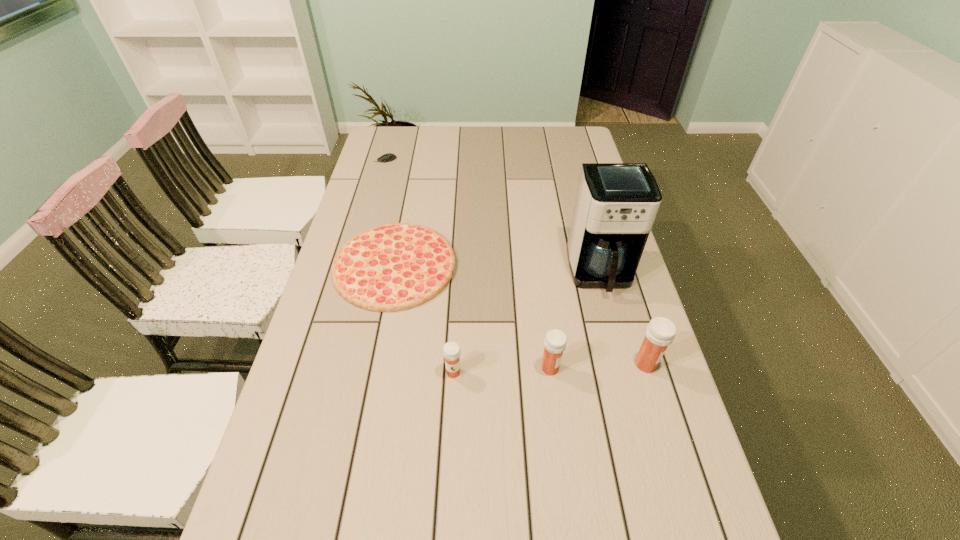
The width and height of the screenshot is (960, 540). In order to click on the shortest medicine in this screenshot , I will do `click(451, 350)`.

Find the location of a particular element. The height and width of the screenshot is (540, 960). the third shortest object is located at coordinates (451, 350).

Image resolution: width=960 pixels, height=540 pixels. Identify the location of the second tallest medicine. [x=555, y=341].

In order to click on the second medicine from left to right in this screenshot , I will do `click(555, 341)`.

Image resolution: width=960 pixels, height=540 pixels. In order to click on the second tallest object in this screenshot , I will do `click(660, 332)`.

Locate an element on the screen. the rightmost medicine is located at coordinates (660, 332).

This screenshot has width=960, height=540. I want to click on computer mouse, so click(388, 157).

Where is `coffee maker`? coffee maker is located at coordinates (616, 204).

What are the coordinates of `pizza` in the screenshot? It's located at (392, 267).

Locate an element on the screen. vacant region located on the label side of the third shortest object is located at coordinates pyautogui.click(x=449, y=450).